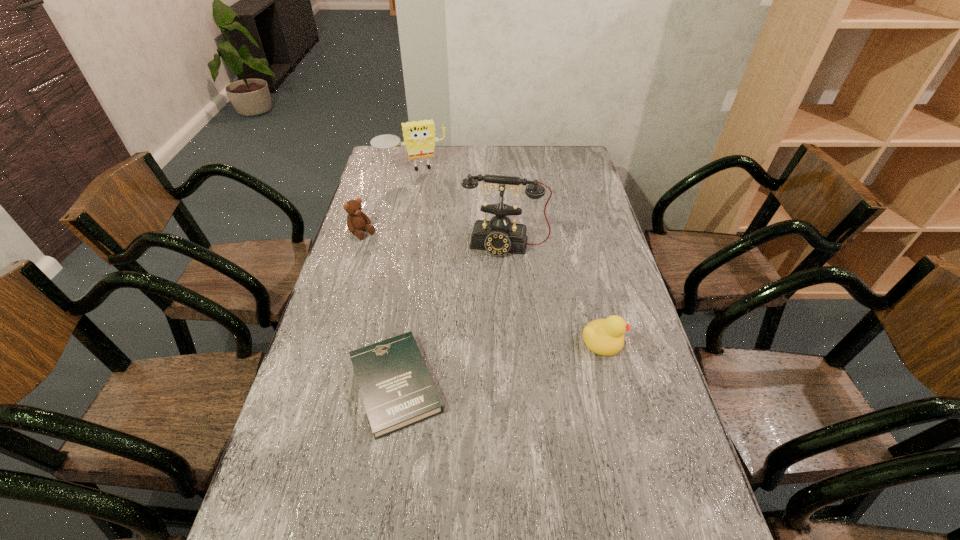
Locate an element on the screen. This screenshot has height=540, width=960. vacant space located on the face of the teddy bear is located at coordinates (387, 253).

You are a GUI agent. You are given a task and a screenshot of the screen. Output one action in this format:
    pyautogui.click(x=<x>, y=<y>)
    Task: Click on the vacant space located on the face of the teddy bear
    
    Given the screenshot: What is the action you would take?
    pyautogui.click(x=436, y=293)

Find the location of a particular element. The image size is (960, 540). free region located on the front-facing side of the second tallest object is located at coordinates (425, 197).

Find the location of a particular element. This screenshot has width=960, height=540. blank space located on the front-facing side of the second tallest object is located at coordinates (428, 205).

Where is `blank area located 0.320m on the front-facing side of the second tallest object`? The height and width of the screenshot is (540, 960). blank area located 0.320m on the front-facing side of the second tallest object is located at coordinates [435, 224].

At what (x,y) coordinates should I click in order to perform the action: click on free region located 0.350m on the dial of the tallest object. Please return your answer as a coordinate pair (x, y). The image size is (960, 540). Looking at the image, I should click on point(483,341).

Locate an element on the screen. This screenshot has height=540, width=960. blank area located 0.330m on the dial of the tallest object is located at coordinates pos(484,336).

The image size is (960, 540). I want to click on vacant space located 0.400m on the dial of the tallest object, so click(x=480, y=356).

At what (x,y) coordinates should I click in order to perform the action: click on object situated at the far edge. Please return your answer as a coordinate pair (x, y). Image resolution: width=960 pixels, height=540 pixels. Looking at the image, I should click on (419, 137).

The height and width of the screenshot is (540, 960). What are the coordinates of `book positioned at the left edge` in the screenshot? It's located at (397, 389).